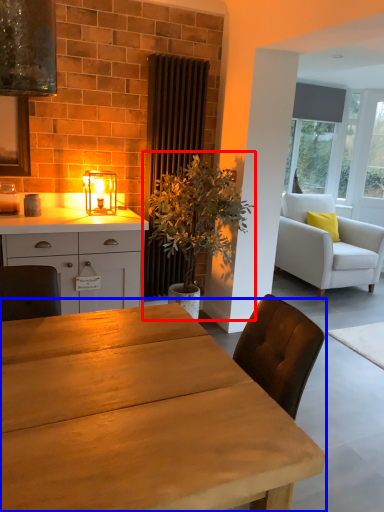
Question: Which object appears closest to the camera in this image, houseplant (highlighted by a red box) or table (highlighted by a blue box)?

Choices:
 (A) houseplant
 (B) table

Answer: (B)